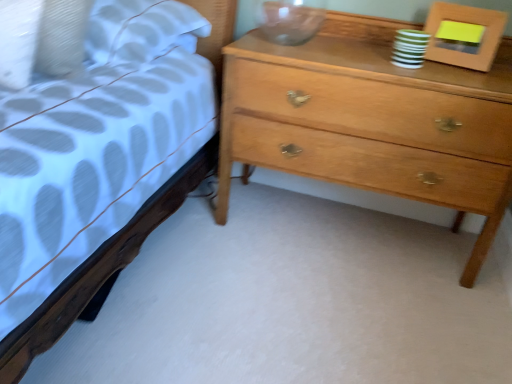
The width and height of the screenshot is (512, 384). In order to click on vacant space in front of wooden picture frame at upper right in this screenshot , I will do `click(468, 73)`.